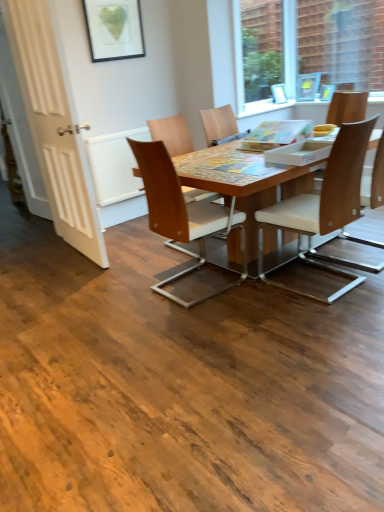
The height and width of the screenshot is (512, 384). Identify the location of transparent glass window at upper right. (306, 47).

The height and width of the screenshot is (512, 384). I want to click on light brown wood chair at right, which is the 1th chair from right to left, so click(x=347, y=106).

Measure the distance between point (355, 101) and camera.

3.36 meters.

In order to click on woodenmaterial/texturetable at center in this screenshot , I will do `click(239, 172)`.

What is the approximate width of wooden chair with white cushion at center, the third chair from the left?

25.60 inches.

Describe the element at coordinates (53, 126) in the screenshot. I see `white wooden door at left` at that location.

At what (x,y) coordinates should I click in order to perform the action: click on white wooden door at left. Please return your answer as a coordinate pair (x, y). Image resolution: width=384 pixels, height=512 pixels. Looking at the image, I should click on (53, 126).

Where is `wooden chair at center, which is counted as the 1th chair, starting from the left`? wooden chair at center, which is counted as the 1th chair, starting from the left is located at coordinates (182, 215).

Is transparent glass window at upper right wider than light brown wood chair at right, the 2th chair in the right-to-left sequence?

Incorrect, the width of transparent glass window at upper right does not surpass that of light brown wood chair at right, the 2th chair in the right-to-left sequence.

Considering the points (362, 12) and (383, 144), which point is in front, point (362, 12) or point (383, 144)?

Point (383, 144)

From the transparent glass window at upper right, count the 2nd chair to the left and point to it. Please provide its 2D coordinates.

[(351, 252)]

Looking at this image, is transparent glass window at upper right positioned beyond the bounds of light brown wood chair at right, the 2th chair in the right-to-left sequence?

That's correct, transparent glass window at upper right is outside of light brown wood chair at right, the 2th chair in the right-to-left sequence.

How many degrees apart are the facing directions of wooden chair at center, which appears as the 2th chair when viewed from the left, and light brown wood chair at right, which is the 1th chair from right to left?

There is a 91.1-degree angle between the facing directions of wooden chair at center, which appears as the 2th chair when viewed from the left, and light brown wood chair at right, which is the 1th chair from right to left.

Which of these two, wooden chair at center, which is the fourth chair in right-to-left order, or light brown wood chair at right, the fifth chair from the left, stands taller?

Standing taller between the two is light brown wood chair at right, the fifth chair from the left.

From a real-world perspective, between wooden chair at center, which appears as the 2th chair when viewed from the left, and light brown wood chair at right, which is the 1th chair from right to left, who is vertically higher?

From a 3D spatial view, wooden chair at center, which appears as the 2th chair when viewed from the left, is above.

Do you think wooden chair at center, which is the fourth chair in right-to-left order, is within light brown wood chair at right, the fifth chair from the left, or outside of it?

wooden chair at center, which is the fourth chair in right-to-left order, exists outside the volume of light brown wood chair at right, the fifth chair from the left.

Does wooden chair with white cushion at center, the third chair from the left, have a larger size compared to light brown wood chair at right, the 2th chair in the right-to-left sequence?

Yes.

Where is `the 2nd chair in front of the light brown wood chair at right, the 2th chair in the right-to-left sequence`? The image size is (384, 512). the 2nd chair in front of the light brown wood chair at right, the 2th chair in the right-to-left sequence is located at coordinates (324, 205).

Can you confirm if wooden chair with white cushion at center, the third chair from the left, is taller than light brown wood chair at right, the 2th chair in the right-to-left sequence?

Indeed, wooden chair with white cushion at center, the third chair from the left, has a greater height compared to light brown wood chair at right, the 2th chair in the right-to-left sequence.

Which of these two, wooden chair with white cushion at center, the third chair from the left, or light brown wood chair at right, the 2th chair in the right-to-left sequence, is wider?

Wider between the two is wooden chair with white cushion at center, the third chair from the left.

Could you tell me if wooden chair with white cushion at center, marked as the third chair in a right-to-left arrangement, is facing woodenmaterial/texturetable at center?

Yes, wooden chair with white cushion at center, marked as the third chair in a right-to-left arrangement, is facing woodenmaterial/texturetable at center.

Which object is closer to the camera, wooden chair with white cushion at center, the third chair from the left, or woodenmaterial/texturetable at center?

wooden chair with white cushion at center, the third chair from the left, is more forward.

Is wooden chair with white cushion at center, marked as the third chair in a right-to-left arrangement, surrounding woodenmaterial/texturetable at center?

No, woodenmaterial/texturetable at center is located outside of wooden chair with white cushion at center, marked as the third chair in a right-to-left arrangement.

How many degrees apart are the facing directions of wooden chair with white cushion at center, the third chair from the left, and woodenmaterial/texturetable at center?

The facing directions of wooden chair with white cushion at center, the third chair from the left, and woodenmaterial/texturetable at center are 89.6 degrees apart.

Can you tell me how much light brown wood chair at right, acting as the fourth chair starting from the left, and white wooden door at left differ in facing direction?

There is a 86.2-degree angle between the facing directions of light brown wood chair at right, acting as the fourth chair starting from the left, and white wooden door at left.

Considering the relative sizes of light brown wood chair at right, the 2th chair in the right-to-left sequence, and white wooden door at left in the image provided, is light brown wood chair at right, the 2th chair in the right-to-left sequence, shorter than white wooden door at left?

Yes, light brown wood chair at right, the 2th chair in the right-to-left sequence, is shorter than white wooden door at left.

You are a GUI agent. You are given a task and a screenshot of the screen. Output one action in this format:
    pyautogui.click(x=<x>, y=<y>)
    Task: Click on the screen door lying above the light brown wood chair at right, the 2th chair in the right-to-left sequence (from the image's perspective)
    Image resolution: width=384 pixels, height=512 pixels.
    Given the screenshot: What is the action you would take?
    pyautogui.click(x=53, y=126)

Based on the photo, would you consider light brown wood chair at right, acting as the fourth chair starting from the left, to be distant from white wooden door at left?

Absolutely, light brown wood chair at right, acting as the fourth chair starting from the left, is distant from white wooden door at left.

Can you confirm if woodenmaterial/texturetable at center is shorter than light brown wood chair at right, which is the 1th chair from right to left?

Correct, woodenmaterial/texturetable at center is not as tall as light brown wood chair at right, which is the 1th chair from right to left.

Can you confirm if woodenmaterial/texturetable at center is positioned to the right of light brown wood chair at right, the fifth chair from the left?

No.

Is woodenmaterial/texturetable at center facing away from light brown wood chair at right, which is the 1th chair from right to left?

Yes, woodenmaterial/texturetable at center's orientation is away from light brown wood chair at right, which is the 1th chair from right to left.

How many degrees apart are the facing directions of woodenmaterial/texturetable at center and light brown wood chair at right, which is the 1th chair from right to left?

The angular difference between woodenmaterial/texturetable at center and light brown wood chair at right, which is the 1th chair from right to left, is 0.345 degrees.

Is wooden chair at center, which is counted as the 1th chair, starting from the left, wider than light brown wood chair at right, which is the 1th chair from right to left?

Correct, the width of wooden chair at center, which is counted as the 1th chair, starting from the left, exceeds that of light brown wood chair at right, which is the 1th chair from right to left.

Is wooden chair at center, the 5th chair positioned from the right, smaller than light brown wood chair at right, the fifth chair from the left?

No, wooden chair at center, the 5th chair positioned from the right, is not smaller than light brown wood chair at right, the fifth chair from the left.

From a real-world perspective, is wooden chair at center, the 5th chair positioned from the right, physically above light brown wood chair at right, the fifth chair from the left?

Incorrect, from a real-world perspective, wooden chair at center, the 5th chair positioned from the right, is lower than light brown wood chair at right, the fifth chair from the left.

The height and width of the screenshot is (512, 384). Find the location of `chair that is the 4th one below the transparent glass window at upper right (from a real-world perspective)`. chair that is the 4th one below the transparent glass window at upper right (from a real-world perspective) is located at coordinates (351, 252).

There is a wooden chair at center, which appears as the 2th chair when viewed from the left. Find the location of `the 1st chair below it (from the image's perspective)`. the 1st chair below it (from the image's perspective) is located at coordinates (347, 106).

Which object lies further to the anchor point wooden chair at center, which appears as the 2th chair when viewed from the left, white wooden door at left or wooden chair with white cushion at center, marked as the third chair in a right-to-left arrangement?

Among the two, white wooden door at left is located further to wooden chair at center, which appears as the 2th chair when viewed from the left.

Looking at the image, which one is located further to wooden chair at center, which is the fourth chair in right-to-left order, transparent glass window at upper right or light brown wood chair at right, acting as the fourth chair starting from the left?

Based on the image, transparent glass window at upper right appears to be further to wooden chair at center, which is the fourth chair in right-to-left order.

Estimate the real-world distances between objects in this image. Which object is further from light brown wood chair at right, acting as the fourth chair starting from the left, wooden chair at center, which appears as the 2th chair when viewed from the left, or wooden chair at center, which is counted as the 1th chair, starting from the left?

wooden chair at center, which appears as the 2th chair when viewed from the left.

Considering their positions, is woodenmaterial/texturetable at center positioned further to light brown wood chair at right, which is the 1th chair from right to left, than wooden chair at center, the 5th chair positioned from the right?

wooden chair at center, the 5th chair positioned from the right.

Estimate the real-world distances between objects in this image. Which object is further from light brown wood chair at right, acting as the fourth chair starting from the left, white wooden door at left or woodenmaterial/texturetable at center?

white wooden door at left.

Looking at the image, which one is located further to light brown wood chair at right, acting as the fourth chair starting from the left, wooden chair at center, the 5th chair positioned from the right, or white wooden door at left?

Among the two, white wooden door at left is located further to light brown wood chair at right, acting as the fourth chair starting from the left.

Estimate the real-world distances between objects in this image. Which object is further from wooden chair at center, which is counted as the 1th chair, starting from the left, light brown wood chair at right, which is the 1th chair from right to left, or white wooden door at left?

Among the two, light brown wood chair at right, which is the 1th chair from right to left, is located further to wooden chair at center, which is counted as the 1th chair, starting from the left.

Looking at the image, which one is located further to woodenmaterial/texturetable at center, transparent glass window at upper right or wooden chair with white cushion at center, the third chair from the left?

transparent glass window at upper right is further to woodenmaterial/texturetable at center.

Identify the location of kitchen & dining room table between white wooden door at left and transparent glass window at upper right in the horizontal direction. This screenshot has height=512, width=384. 239,172.

This screenshot has height=512, width=384. What are the coordinates of `kitchen & dining room table between transparent glass window at upper right and wooden chair at center, the 5th chair positioned from the right, vertically` in the screenshot? It's located at (239, 172).

Identify the location of kitchen & dining room table between wooden chair with white cushion at center, the third chair from the left, and wooden chair at center, which is the fourth chair in right-to-left order, in the front-back direction. (239, 172).

This screenshot has width=384, height=512. Identify the location of kitchen & dining room table between wooden chair at center, the 5th chair positioned from the right, and light brown wood chair at right, the 2th chair in the right-to-left sequence, from left to right. (239, 172).